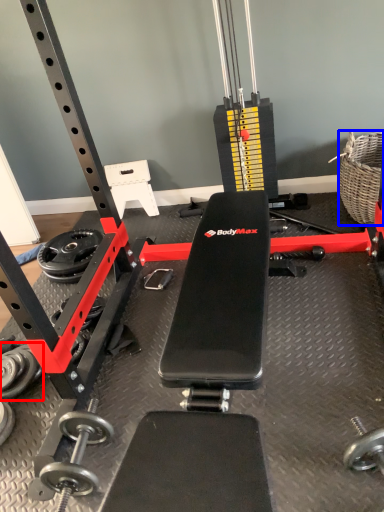
Question: Which object appears farthest to the camera in this image, dumbbell (highlighted by a red box) or basket (highlighted by a blue box)?

Choices:
 (A) dumbbell
 (B) basket

Answer: (B)